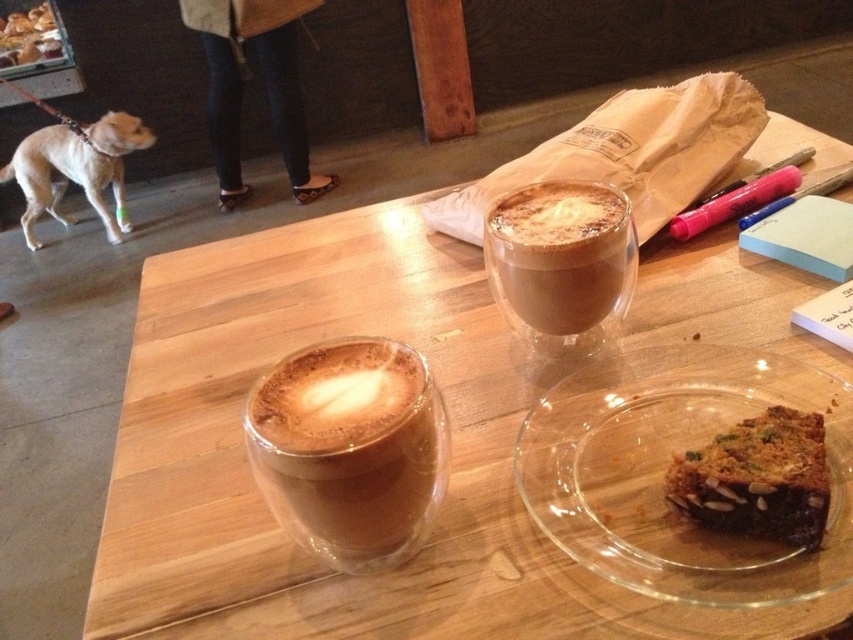
You are sitting at the wooden table in the center of the image. You want to reach for the chocolate cake at center. Which direction should you move your hand to grab it?

The chocolate cake at center is located at point coordinates, so you should move your hand towards the center of the table to reach it.

You are a barista trying to clean the matte glass cup at upper center. The cleaning spray can only reach up to 18 inches. Will you be able to clean it without moving closer?

The matte glass cup at upper center is 18.84 inches away from camera, so the spray cannot reach it. You need to move closer to clean it.